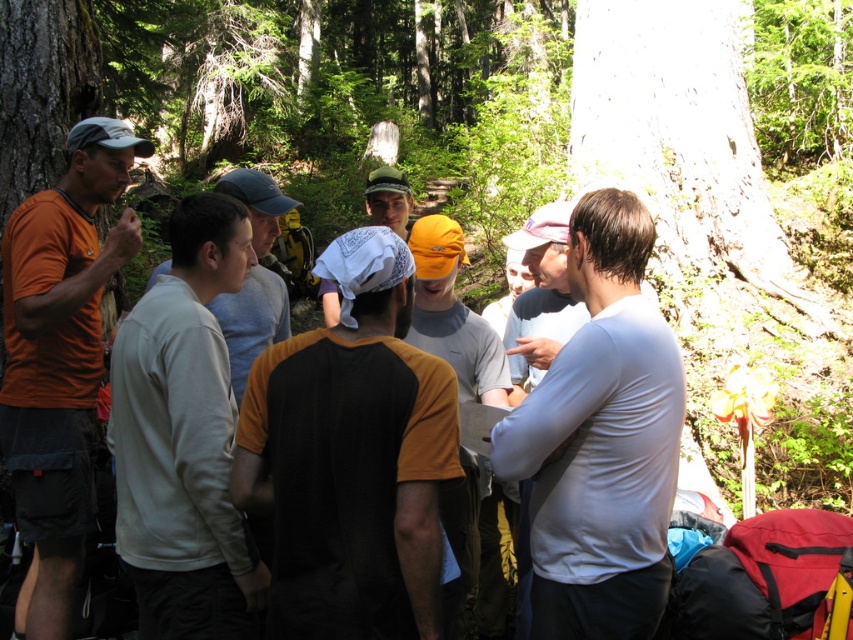
Is black jersey at center thinner than white smooth shirt at center?

In fact, black jersey at center might be wider than white smooth shirt at center.

Which is below, black jersey at center or white smooth shirt at center?

white smooth shirt at center is below.

Who is more distant from viewer, (300, 563) or (492, 456)?

The point (492, 456) is more distant.

Where is `black jersey at center`? black jersey at center is located at coordinates (351, 460).

Can you confirm if white fleece shirt at center is positioned below matte orange t-shirt at left?

Yes.

Is white fleece shirt at center thinner than matte orange t-shirt at left?

Yes.

Does point (264, 589) come closer to viewer compared to point (68, 612)?

Yes, it is.

I want to click on white fleece shirt at center, so click(184, 438).

Does point (143, 346) come closer to viewer compared to point (167, 262)?

Yes, point (143, 346) is in front of point (167, 262).

Who is taller, white fleece shirt at center or gray cotton shirt at center?

With more height is white fleece shirt at center.

Does point (132, 474) come farther from viewer compared to point (260, 332)?

No, it is not.

You are a GUI agent. You are given a task and a screenshot of the screen. Output one action in this format:
    pyautogui.click(x=<x>, y=<y>)
    Task: Click on the white fleece shirt at center
    The height and width of the screenshot is (640, 853).
    Given the screenshot: What is the action you would take?
    pyautogui.click(x=184, y=438)